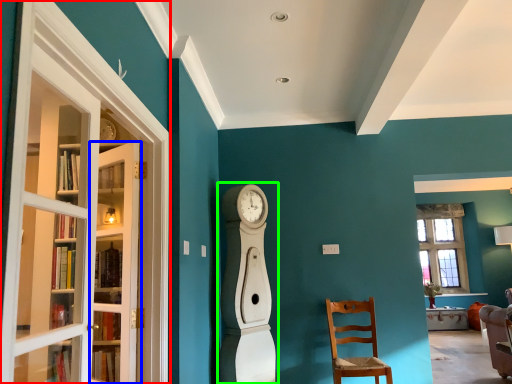
Question: Which object is the farthest from screen door (highlighted by a red box)? Choose among these: door (highlighted by a blue box) or open (highlighted by a green box).

Choices:
 (A) door
 (B) open

Answer: (B)